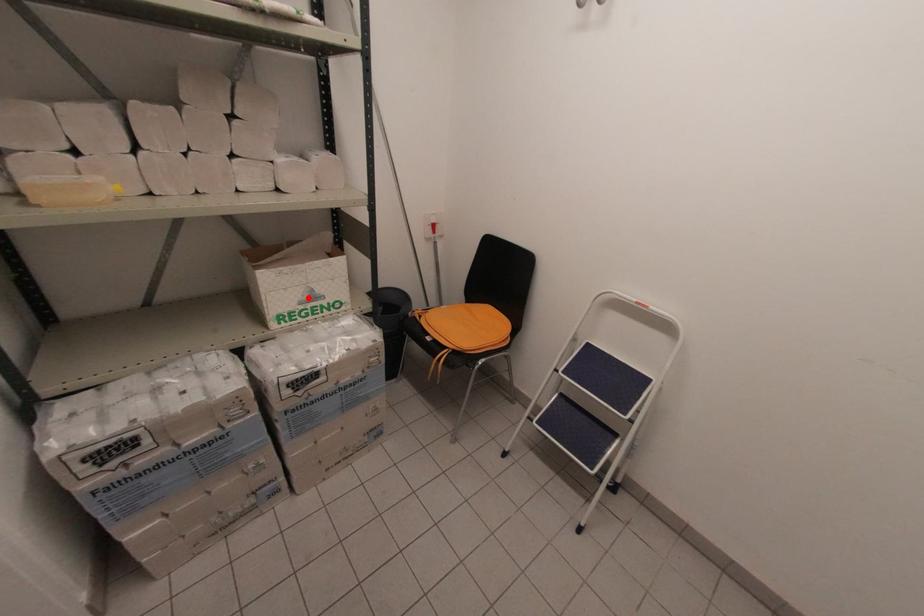
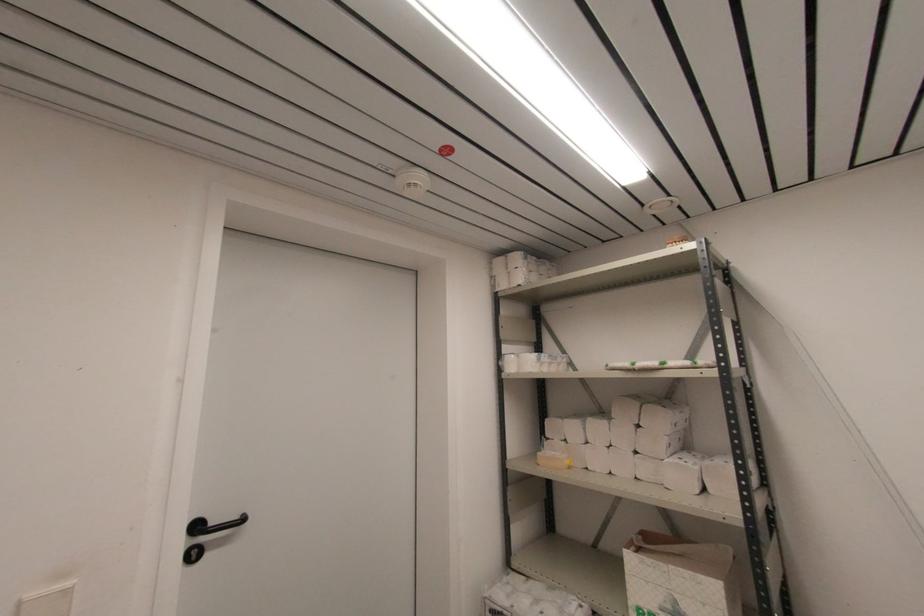
Where in the second image is the point corresponding to the highlighted location from the first image?

(671, 609)